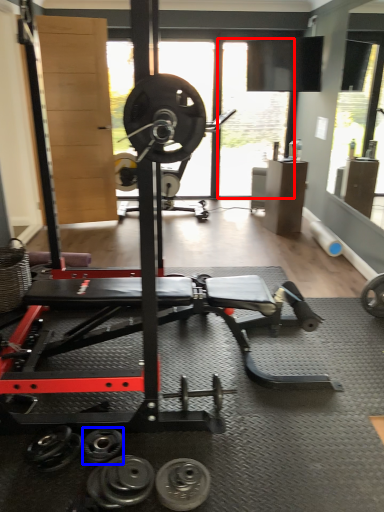
Question: Among these objects, which one is farthest to the camera, window screen (highlighted by a red box) or dumbbell (highlighted by a blue box)?

Choices:
 (A) window screen
 (B) dumbbell

Answer: (A)